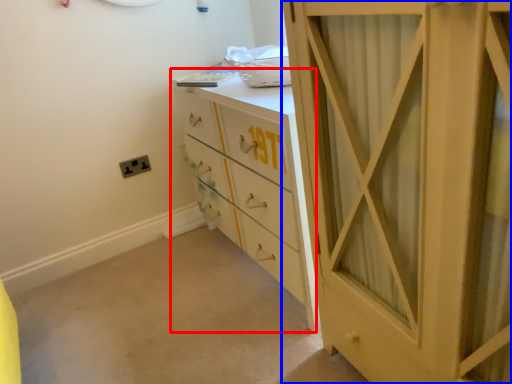
Question: Which point is further to the camera, chest of drawers (highlighted by a red box) or cupboard (highlighted by a blue box)?

Choices:
 (A) chest of drawers
 (B) cupboard

Answer: (A)